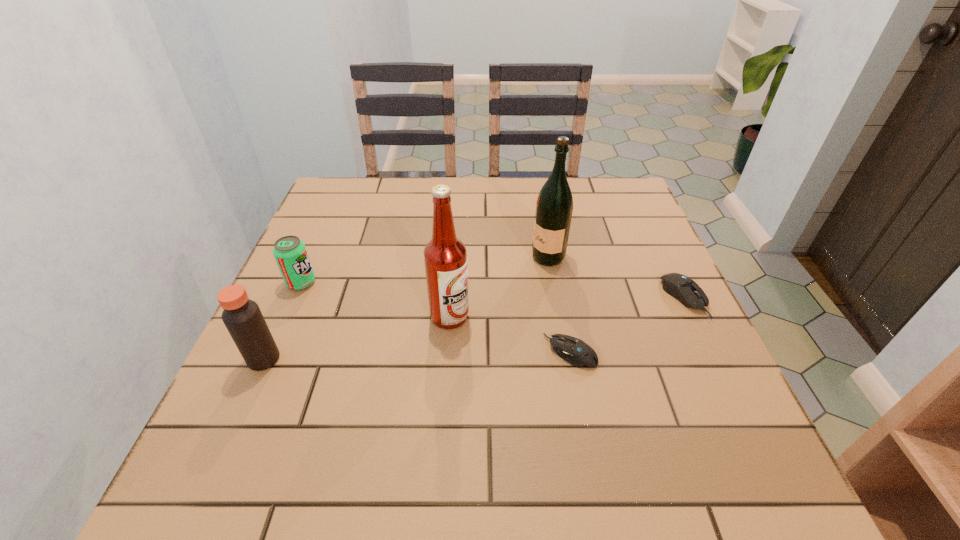
Please point a spot on the left to add another computer mouse. Please provide its 2D coordinates. Your answer should be formatted as a tuple, i.e. [(x, y)], where the tuple contains the x and y coordinates of a point satisfying the conditions above.

[(422, 422)]